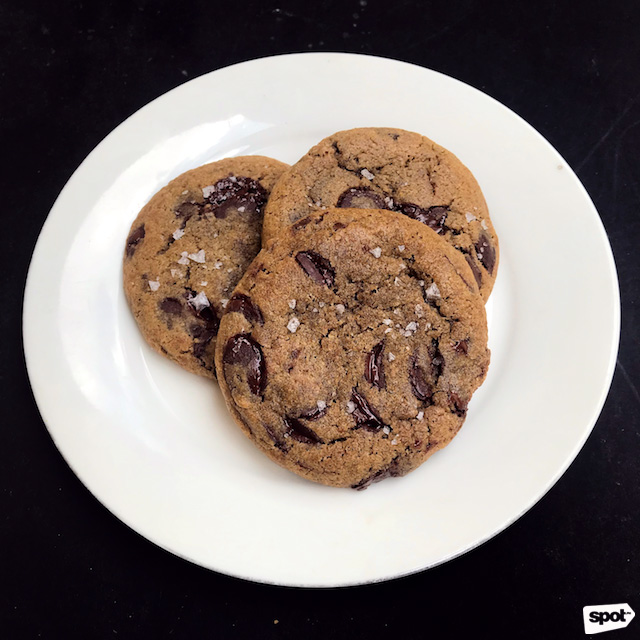
Where is `white plate`? Image resolution: width=640 pixels, height=640 pixels. white plate is located at coordinates (131, 420).